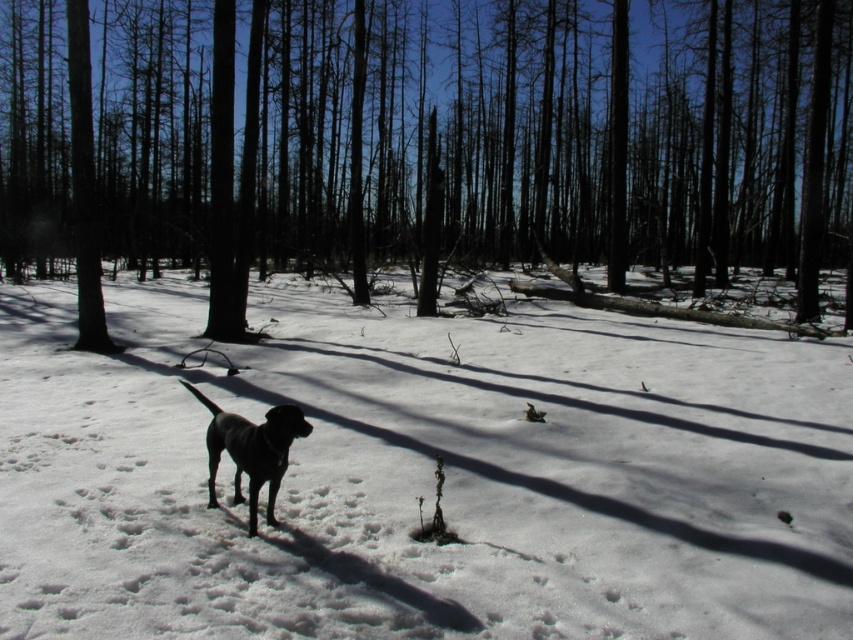
Question: Which of the following is the farthest from the observer?

Choices:
 (A) white powdery snow at center
 (B) brown wood tree at center
 (C) shiny black dog at center

Answer: (B)

Question: Considering the real-world distances, which object is farthest from the shiny black dog at center?

Choices:
 (A) brown wood tree at center
 (B) white powdery snow at center

Answer: (A)

Question: Based on their relative distances, which object is nearer to the shiny black dog at center?

Choices:
 (A) brown wood tree at center
 (B) white powdery snow at center

Answer: (B)

Question: Is white powdery snow at center further to camera compared to brown wood tree at center?

Choices:
 (A) yes
 (B) no

Answer: (B)

Question: Is brown wood tree at center wider than shiny black dog at center?

Choices:
 (A) no
 (B) yes

Answer: (B)

Question: Is brown wood tree at center positioned before shiny black dog at center?

Choices:
 (A) yes
 (B) no

Answer: (B)